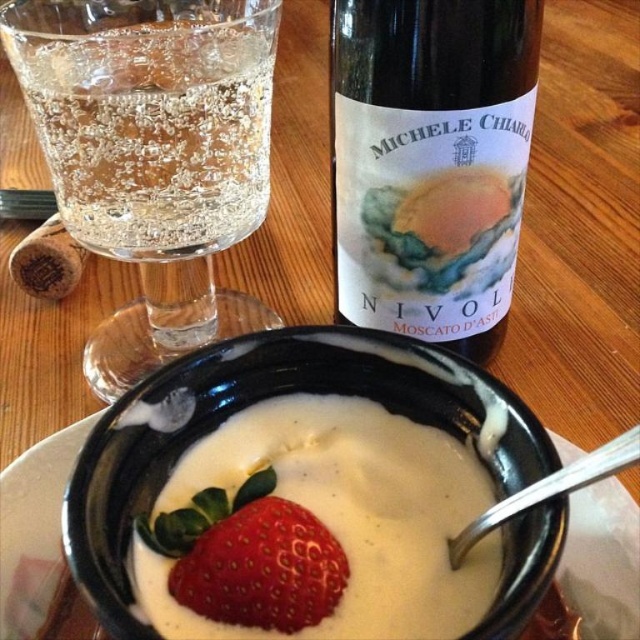
Please provide the coordinates of the clear glass wine glass at upper left in the image. The coordinate system has the origin at the bottom left corner of the image, with x increasing to the right and y increasing upwards.

The clear glass wine glass at upper left is located at coordinates point (152,154).

You are a guest at a dinner party and want to pour wine from the dark brown glass bottle at upper right into the glass next to the matte black bowl at center. However, the glass is already half full. Is there enough space in the glass to hold the remaining wine from the bottle without spilling?

The dark brown glass bottle at upper right is larger in size than the matte black bowl at center, but this does not provide information about the glass or its capacity. Therefore, it is uncertain if the glass can hold the remaining wine without spilling.

You are at a dinner party and need to pour more wine into the clear glass wine glass at upper left. However, the glass is already filled to the brim. Can you pour the wine into the matte black bowl at center without spilling?

The clear glass wine glass at upper left is larger than the matte black bowl at center, so pouring wine from the larger glass into the smaller bowl may result in spillage due to the smaller capacity of the matte black bowl at center.